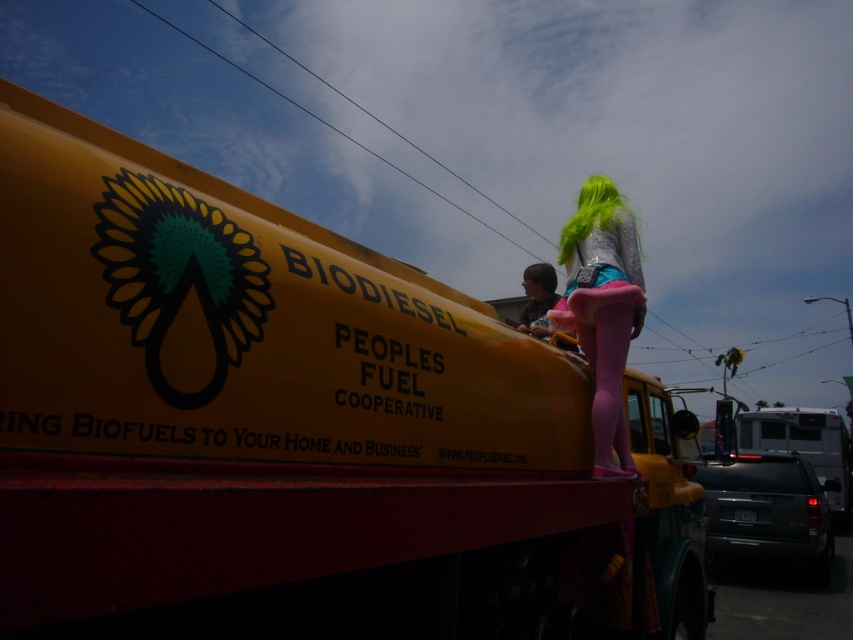
Who is lower down, neon green hair at upper right or matte brown hair at center?

matte brown hair at center

Between point (614, 257) and point (547, 269), which one is positioned behind?

Positioned behind is point (547, 269).

Between point (627, 301) and point (531, 276), which one is positioned behind?

The point (531, 276) is more distant.

This screenshot has height=640, width=853. I want to click on neon green hair at upper right, so click(602, 308).

Looking at this image, is yellow matte truck at upper center bigger than matte brown hair at center?

Yes.

Which is in front, point (25, 628) or point (543, 282)?

Point (25, 628)

Measure the distance between yellow matte truck at upper center and camera.

yellow matte truck at upper center is 28.13 inches away from camera.

This screenshot has height=640, width=853. I want to click on yellow matte truck at upper center, so click(294, 426).

Can you confirm if neon green hair at upper right is thinner than green silky hair at upper right?

Yes.

Does neon green hair at upper right appear on the left side of green silky hair at upper right?

Correct, you'll find neon green hair at upper right to the left of green silky hair at upper right.

Find the location of a particular element. The image size is (853, 640). neon green hair at upper right is located at coordinates coord(602,308).

Locate an element on the screen. This screenshot has width=853, height=640. neon green hair at upper right is located at coordinates pyautogui.click(x=602, y=308).